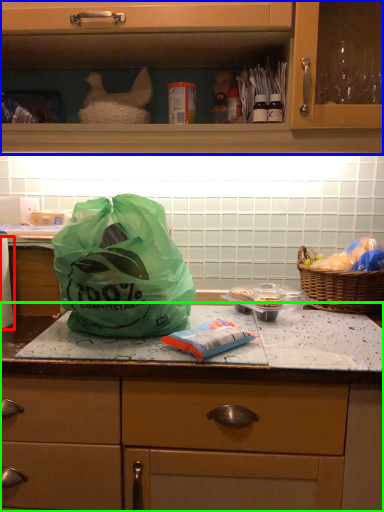
Question: Estimate the real-world distances between objects in this image. Which object is farther from toilet paper (highlighted by a red box), cabinetry (highlighted by a blue box) or countertop (highlighted by a green box)?

Choices:
 (A) cabinetry
 (B) countertop

Answer: (A)